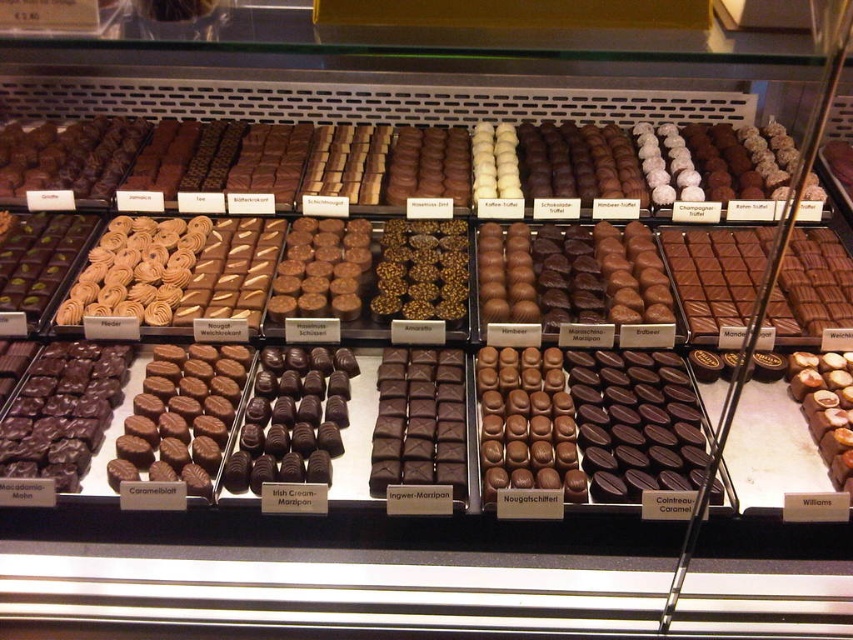
You are a customer at the chocolate display case and want to choose a chocolate. You notice the shiny brown chocolate bar at right and the matte chocolate nougat at center. Which one do you think is bigger?

The shiny brown chocolate bar at right is larger in size compared to the matte chocolate nougat at center, so it is bigger.